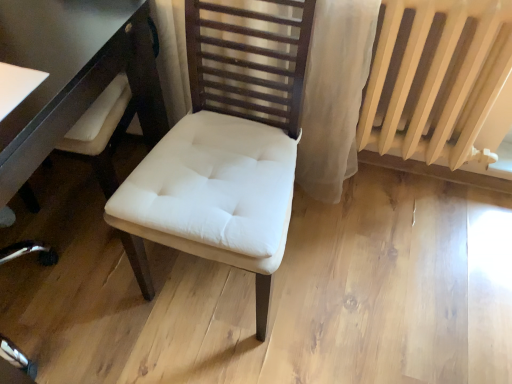
Locate an element on the screen. free space underneath white fabric chair at center (from a real-world perspective) is located at coordinates (221, 285).